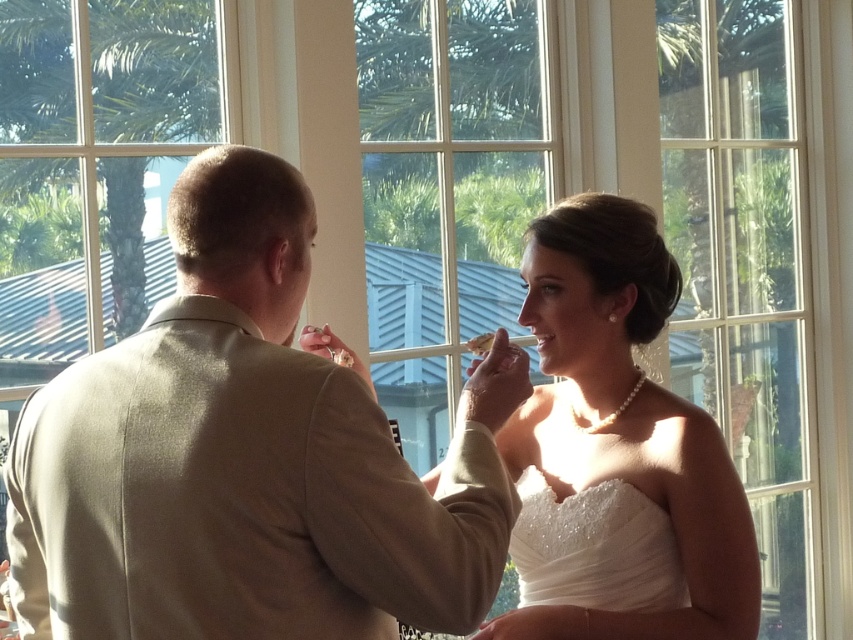
Question: Which of these objects is positioned closest to the tan fabric suit at center?

Choices:
 (A) white beaded fabric at center
 (B) pearl necklace at upper center

Answer: (B)

Question: Estimate the real-world distances between objects in this image. Which object is closer to the white beaded fabric at center?

Choices:
 (A) pearl necklace at upper center
 (B) tan fabric suit at center

Answer: (A)

Question: Can you confirm if tan fabric suit at center is bigger than pearl necklace at upper center?

Choices:
 (A) yes
 (B) no

Answer: (A)

Question: Which point is farther to the camera?

Choices:
 (A) (689, 502)
 (B) (579, 541)

Answer: (B)

Question: Does tan fabric suit at center appear on the right side of pearl necklace at upper center?

Choices:
 (A) no
 (B) yes

Answer: (A)

Question: In this image, where is pearl necklace at upper center located relative to white beaded fabric at center?

Choices:
 (A) left
 (B) right

Answer: (B)